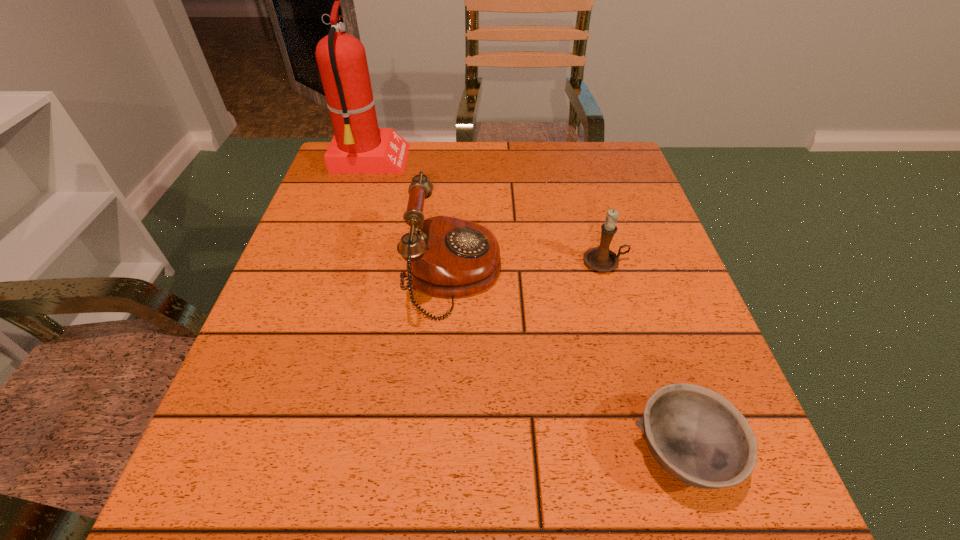
Image resolution: width=960 pixels, height=540 pixels. I want to click on blank area located 0.070m on the back of the bowl, so click(x=655, y=367).

Locate an element on the screen. The height and width of the screenshot is (540, 960). object situated at the far edge is located at coordinates (358, 146).

The image size is (960, 540). I want to click on object that is at the near edge, so click(699, 437).

What are the coordinates of `object located in the left edge section of the desktop` in the screenshot? It's located at [x=358, y=146].

Identify the location of candle holder situated at the right edge. (601, 259).

The image size is (960, 540). I want to click on bowl located in the right edge section of the desktop, so click(x=699, y=437).

The width and height of the screenshot is (960, 540). What are the coordinates of `object that is at the far left corner` in the screenshot? It's located at (358, 146).

Where is `object located at the near right corner`? The width and height of the screenshot is (960, 540). object located at the near right corner is located at coordinates (699, 437).

Identify the location of vacant space at the far edge of the desktop. (498, 153).

What are the coordinates of `vacant space at the left edge` in the screenshot? It's located at (334, 339).